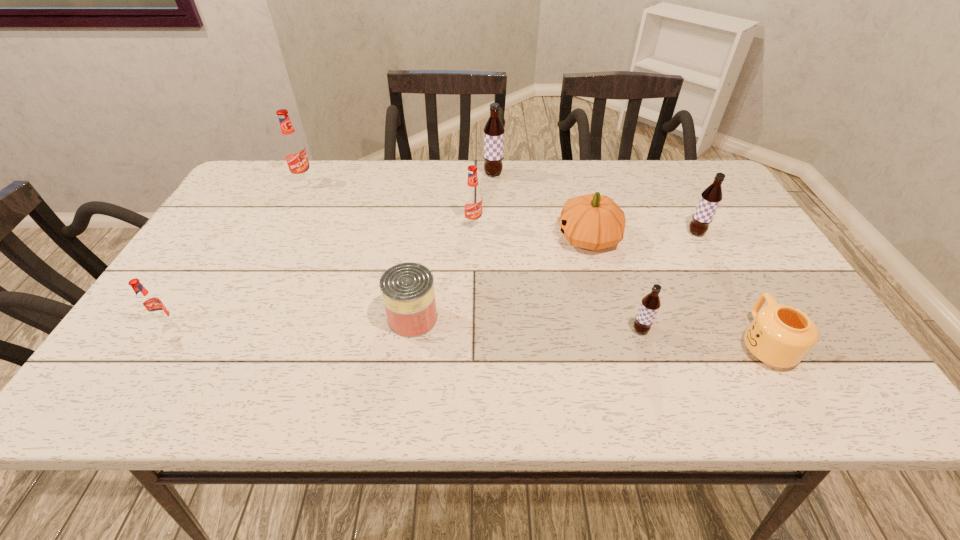
Find the location of a particular element. The width and height of the screenshot is (960, 540). vacant space located on the side of the gourd with the carved face is located at coordinates (427, 238).

The height and width of the screenshot is (540, 960). In order to click on vacant space located on the side of the gourd with the carved face in this screenshot , I will do `click(457, 238)`.

This screenshot has height=540, width=960. Find the location of `vacant space situated on the left of the fifth root beer from left to right`. vacant space situated on the left of the fifth root beer from left to right is located at coordinates (502, 330).

Locate an element on the screen. The width and height of the screenshot is (960, 540). vacant area situated on the right of the leftmost object is located at coordinates (335, 325).

Locate an element on the screen. vacant space located on the right of the can is located at coordinates (528, 318).

What are the coordinates of `vacant space located 0.250m on the handle side of the mug` in the screenshot? It's located at (708, 243).

I want to click on free space located 0.150m on the handle side of the mug, so [723, 269].

Identify the location of free region located 0.100m on the handle side of the mug. (731, 284).

You are a GUI agent. You are given a task and a screenshot of the screen. Output one action in this format:
    pyautogui.click(x=<x>, y=<y>)
    Task: Click on the object at the near edge
    This screenshot has height=540, width=960.
    Given the screenshot: What is the action you would take?
    pyautogui.click(x=780, y=335)

Locate an element on the screen. The image size is (960, 540). root beer that is at the right edge is located at coordinates (711, 197).